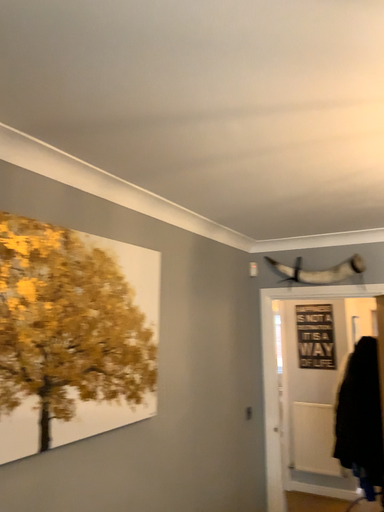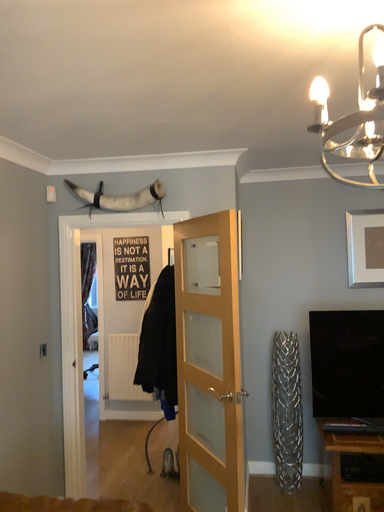
Question: How did the camera likely rotate when shooting the video?

Choices:
 (A) rotated downward
 (B) rotated upward

Answer: (A)